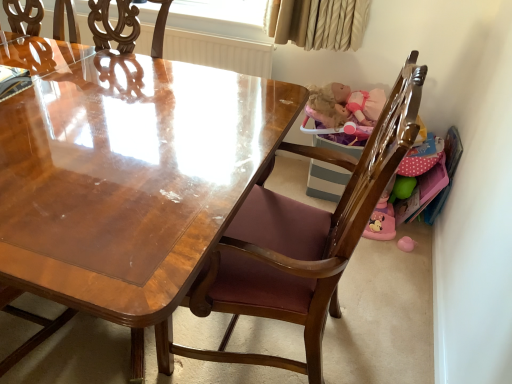
Question: Should I look upward or downward to see transparent plastic window screen at upper center?

Choices:
 (A) down
 (B) up

Answer: (B)

Question: Does mahogany wood chair at center have a smaller size compared to transparent plastic window screen at upper center?

Choices:
 (A) no
 (B) yes

Answer: (A)

Question: Is mahogany wood chair at center shorter than transparent plastic window screen at upper center?

Choices:
 (A) no
 (B) yes

Answer: (A)

Question: From the image's perspective, is mahogany wood chair at center under transparent plastic window screen at upper center?

Choices:
 (A) yes
 (B) no

Answer: (A)

Question: Does mahogany wood chair at center have a larger size compared to transparent plastic window screen at upper center?

Choices:
 (A) no
 (B) yes

Answer: (B)

Question: Considering the relative sizes of mahogany wood chair at center and transparent plastic window screen at upper center in the image provided, is mahogany wood chair at center taller than transparent plastic window screen at upper center?

Choices:
 (A) yes
 (B) no

Answer: (A)

Question: Is mahogany wood chair at center facing away from transparent plastic window screen at upper center?

Choices:
 (A) yes
 (B) no

Answer: (B)

Question: Is the surface of transparent plastic window screen at upper center in direct contact with mahogany wood chair at center?

Choices:
 (A) yes
 (B) no

Answer: (B)

Question: Is transparent plastic window screen at upper center wider than mahogany wood chair at center?

Choices:
 (A) yes
 (B) no

Answer: (B)

Question: From a real-world perspective, does transparent plastic window screen at upper center sit lower than mahogany wood chair at center?

Choices:
 (A) no
 (B) yes

Answer: (A)

Question: Could you tell me if transparent plastic window screen at upper center is turned towards mahogany wood chair at center?

Choices:
 (A) yes
 (B) no

Answer: (B)

Question: Does transparent plastic window screen at upper center appear on the left side of mahogany wood chair at center?

Choices:
 (A) yes
 (B) no

Answer: (A)

Question: Does transparent plastic window screen at upper center have a lesser width compared to mahogany wood chair at center?

Choices:
 (A) no
 (B) yes

Answer: (B)

Question: Considering the positions of mahogany wood chair at center and transparent plastic window screen at upper center in the image, is mahogany wood chair at center taller or shorter than transparent plastic window screen at upper center?

Choices:
 (A) tall
 (B) short

Answer: (A)